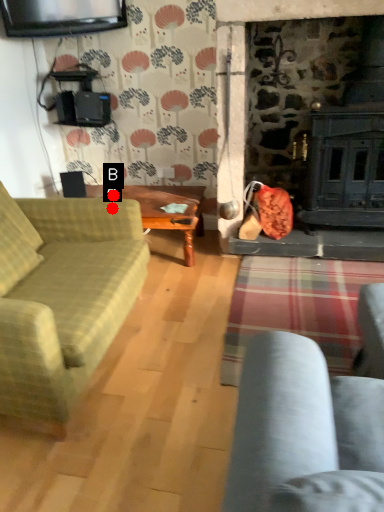
Question: Two points are circled on the image, labeled by A and B beside each circle. Which point is closer to the camera taking this photo?

Choices:
 (A) A is closer
 (B) B is closer

Answer: (A)